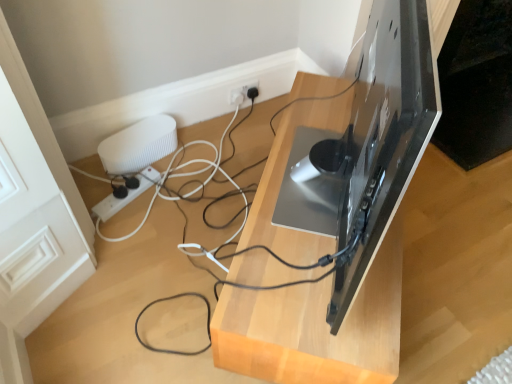
Identify the location of vacant area that lies between matte black tv stand at center and white plastic power strip at lower left. (189, 230).